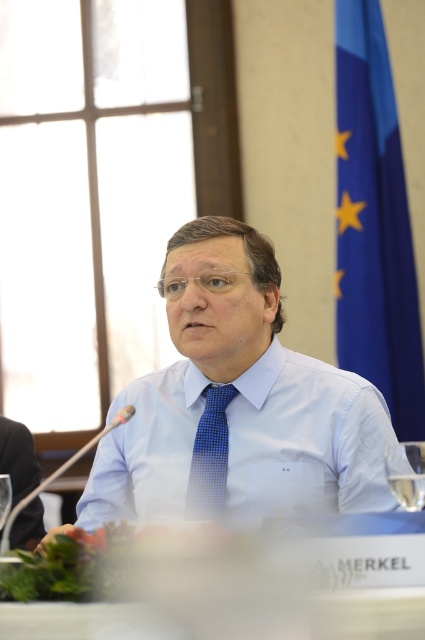
Is light blue shirt at center above blue fabric flag at right?

Incorrect, light blue shirt at center is not positioned above blue fabric flag at right.

Is point (229, 310) in front of point (343, 305)?

Yes.

Where is `light blue shirt at center`? The image size is (425, 640). light blue shirt at center is located at coordinates (234, 396).

Is blue fabric flag at right below blue dotted tie at center?

Actually, blue fabric flag at right is above blue dotted tie at center.

Who is more forward, (357, 316) or (212, 477)?

Positioned in front is point (212, 477).

This screenshot has width=425, height=640. Find the location of `blue fabric flag at right`. blue fabric flag at right is located at coordinates (374, 224).

Can you confirm if light blue shirt at center is taller than blue dotted tie at center?

Correct, light blue shirt at center is much taller as blue dotted tie at center.

Is light blue shirt at center further to camera compared to blue dotted tie at center?

No, light blue shirt at center is in front of blue dotted tie at center.

This screenshot has width=425, height=640. What do you see at coordinates (234, 396) in the screenshot? I see `light blue shirt at center` at bounding box center [234, 396].

I want to click on light blue shirt at center, so click(x=234, y=396).